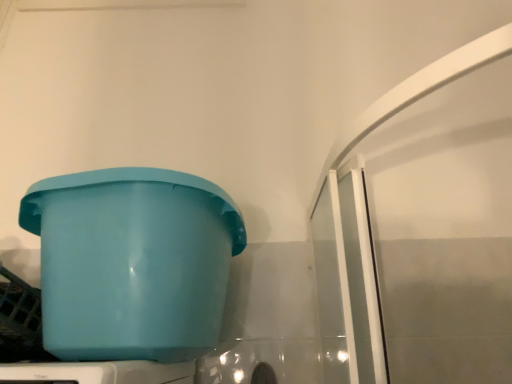
Describe the element at coordinates (132, 262) in the screenshot. The width and height of the screenshot is (512, 384). I see `teal plastic bucket at left` at that location.

Where is `teal plastic bucket at left`? This screenshot has height=384, width=512. teal plastic bucket at left is located at coordinates (132, 262).

Identify the location of teal plastic bucket at left. (132, 262).